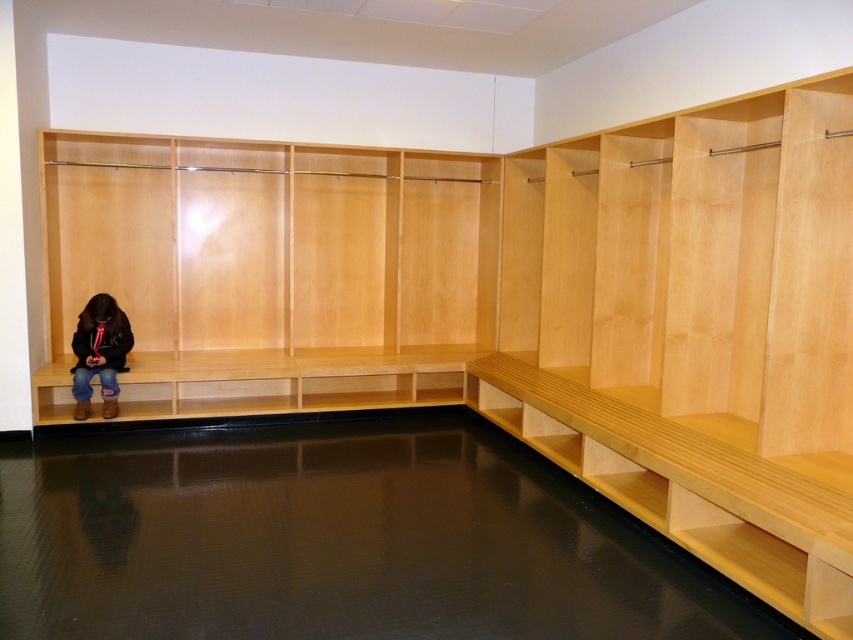
You are trying to decide whether to place a 2ft wide box on the light wood bench at left or the dark brown leather boots at lower left. Based on their widths, which surface can fit the box?

The light wood bench at left has a greater width than the dark brown leather boots at lower left. Since the box is 2ft wide, it can fit on the light wood bench at left but likely not on the dark brown leather boots at lower left.

You are standing in the locker room and want to place your dark brown leather boots at lower left near the light wood bench at left. Based on their positions, where should you place the boots relative to the bench?

The dark brown leather boots at lower left should be placed behind the light wood bench at left as they are positioned behind it.